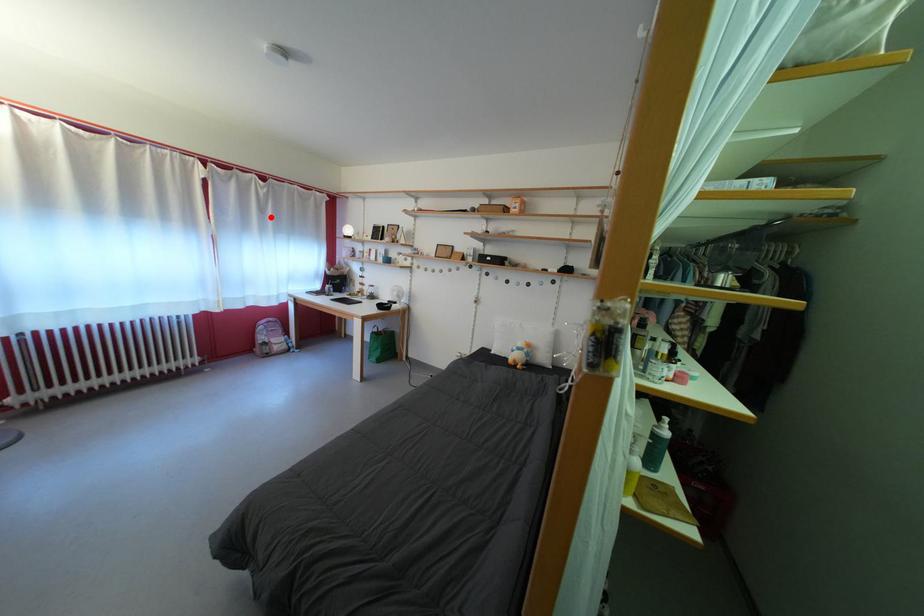
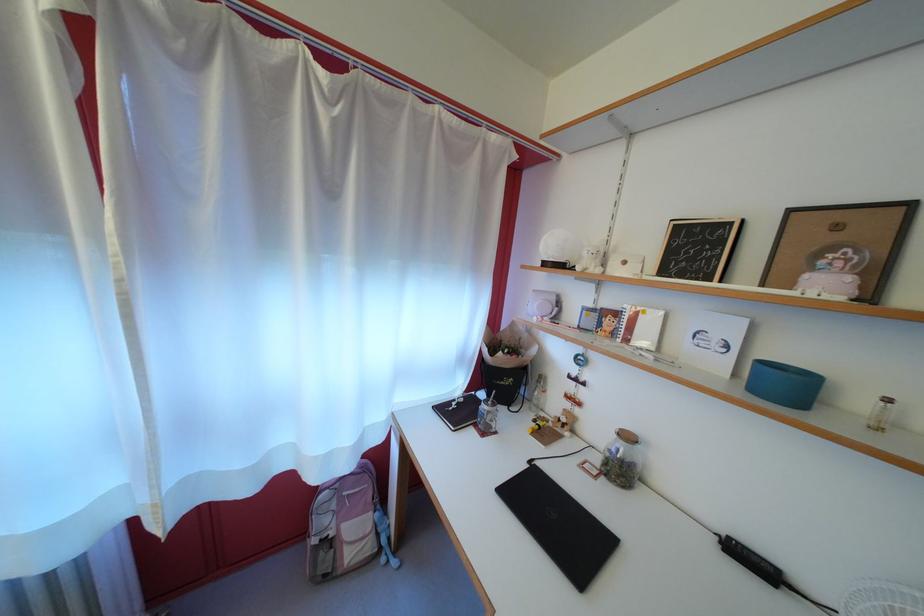
Where in the second image is the point corresponding to the highlighted location from the first image?

(335, 193)